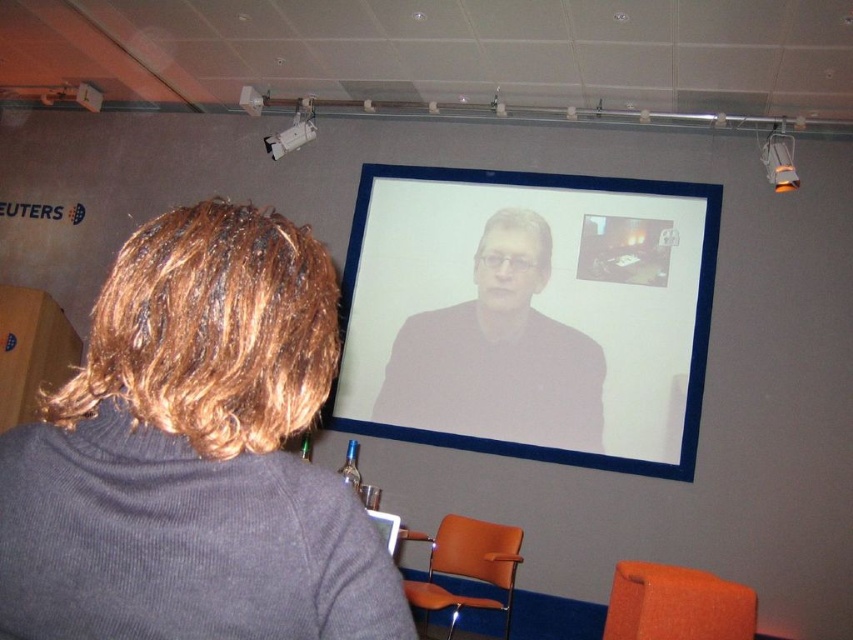
Question: Which point is closer to the camera?

Choices:
 (A) (450, 541)
 (B) (607, 621)
 (C) (573, 337)

Answer: (B)

Question: Which of the following is the closest to the observer?

Choices:
 (A) (294, 131)
 (B) (746, 618)
 (C) (561, 438)

Answer: (B)

Question: Is matte black screen at upper center bigger than white plastic projector at upper center?

Choices:
 (A) no
 (B) yes

Answer: (B)

Question: Does matte black screen at upper center appear on the right side of white plastic projector at upper center?

Choices:
 (A) yes
 (B) no

Answer: (A)

Question: Is orange leather chair at lower right to the right of white plastic projector at upper center from the viewer's perspective?

Choices:
 (A) no
 (B) yes

Answer: (B)

Question: Which of these objects is positioned closest to the gray ribbed sweater at lower left?

Choices:
 (A) white plastic projector at upper center
 (B) orange fabric chair at lower right
 (C) orange leather chair at lower right
 (D) matte black screen at upper center

Answer: (B)